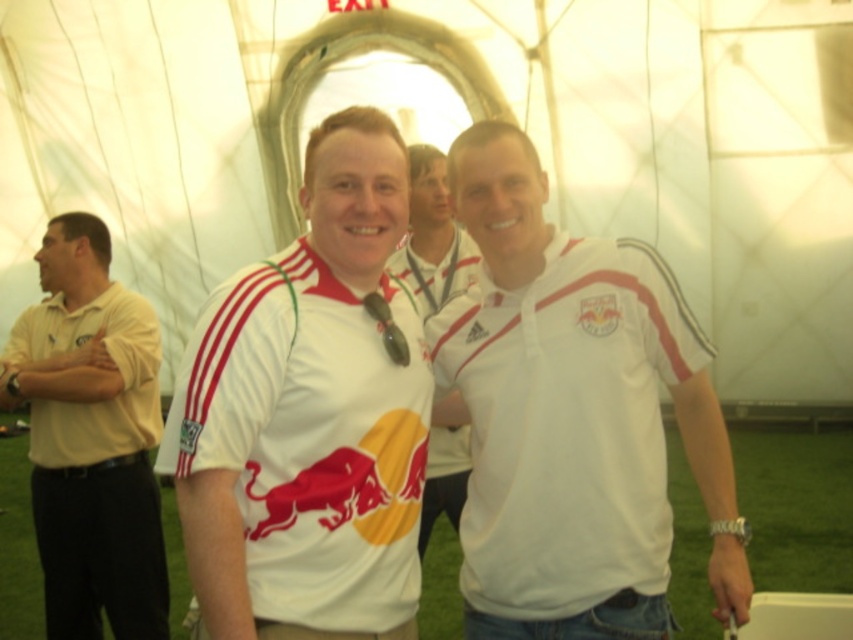
You are a photographer standing 5 feet away from the two people in the image. You need to capture a photo where both the white matte shirt at center and the white fabric shirt at center are clearly visible in the frame. Considering their distance apart, will you be able to fit both shirts into your camera view without zooming in?

The white matte shirt at center and white fabric shirt at center are 27.14 inches apart from each other. Since you are 5 feet away, which is 60 inches, the distance between them is less than half your distance from them. This means both shirts can easily fit within the camera frame without needing to zoom in.

You are standing at the point labeled point (47, 262) in the image. If you want to move 10 feet towards the viewer, will you be able to reach the viewer within that distance?

The distance between point (47, 262) and the viewer is 19.46 feet. Moving 10 feet towards the viewer would leave you 9.46 feet away from the viewer, so you won